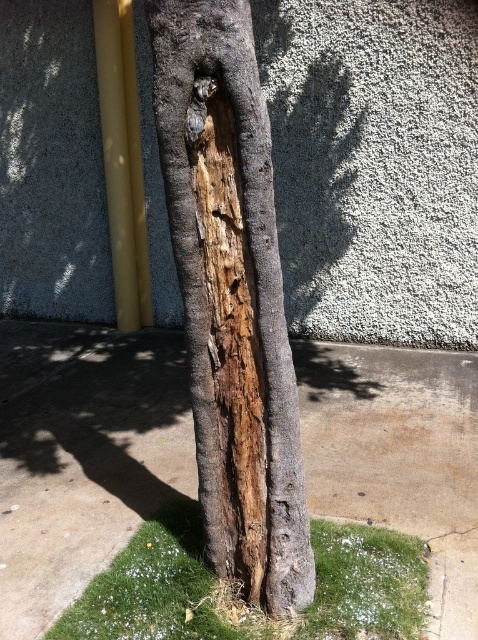
You are standing at the base of the damaged tree trunk and want to step onto the brown concrete pavement at center. Based on the coordinates provided in the description, is the pavement directly in front of you or to your side?

The brown concrete pavement at center is located at point (82, 456), which suggests it is positioned to your side rather than directly in front, so you would need to move laterally to reach it.

You are a park maintenance worker inspecting the tree trunk leaning against the white textured wall. You notice a point at coordinates (x=231, y=298). What is located at that point?

At point (x=231, y=298) lies dark brown wood at center.

You are a gardener assessing the health of the tree. You notice the dark brown wood at center and the green mossy grass at lower center. Which of these two has a smaller width?

The dark brown wood at center has a smaller width than the green mossy grass at lower center.